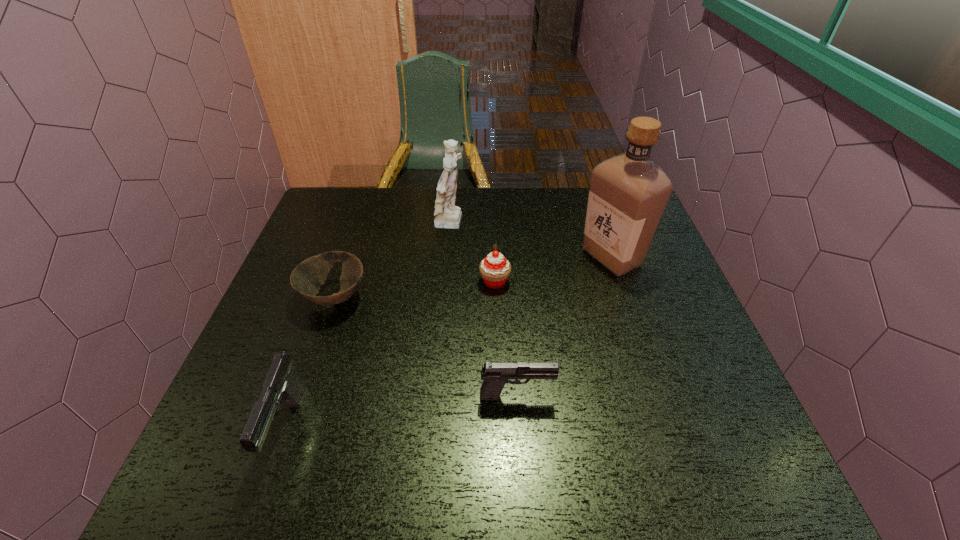
Please point a spot on the right to add another pistol. Please provide its 2D coordinates. Your answer should be formatted as a tuple, i.e. [(x, y)], where the tuple contains the x and y coordinates of a point satisfying the conditions above.

[(720, 366)]